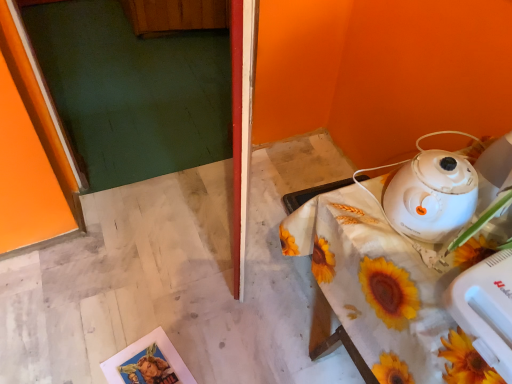
Image resolution: width=512 pixels, height=384 pixels. I want to click on vacant area to the left of white plastic mixer at lower right, so (410, 295).